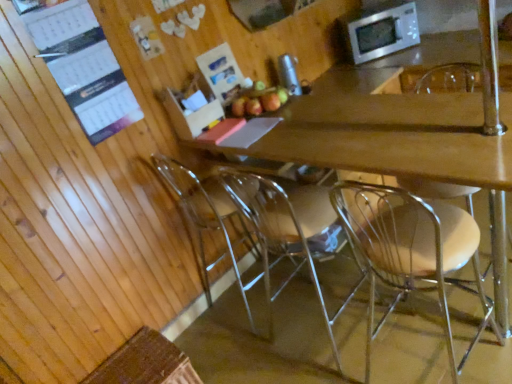
Find the location of a particular element. Image resolution: width=512 pixels, height=384 pixels. vacant area situated below clear acrylic chair at center, acting as the second chair starting from the left (from a real-world perspective) is located at coordinates (318, 335).